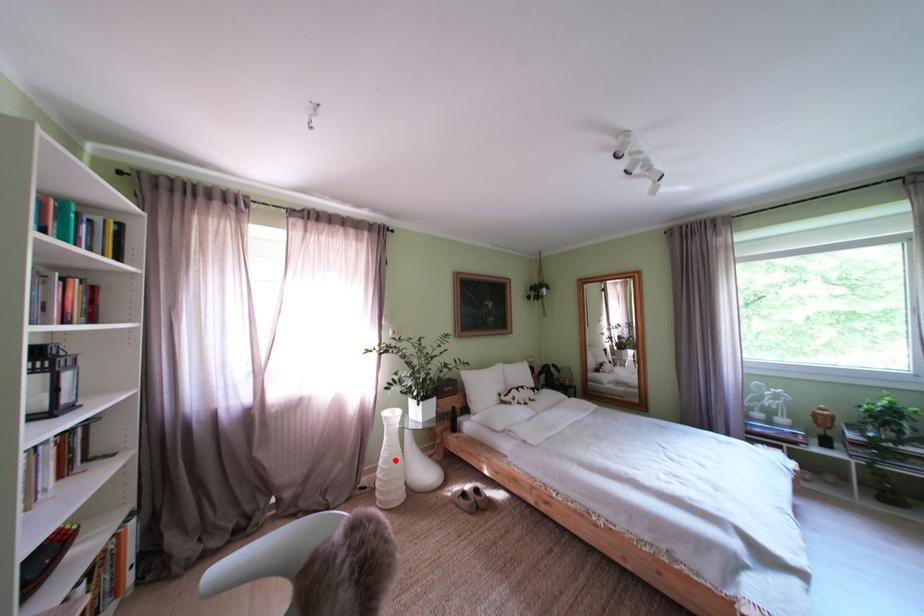
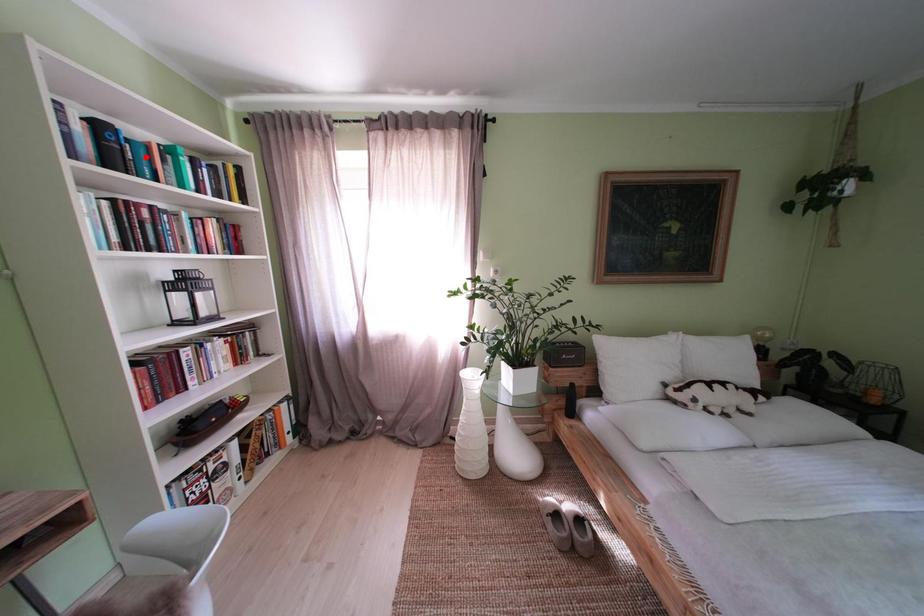
I am providing you with two images of the same scene from different viewpoints. A red point is marked on the first image and another point is marked on the second image. Does the point marked in image1 correspond to the same location as the one in image2?

No